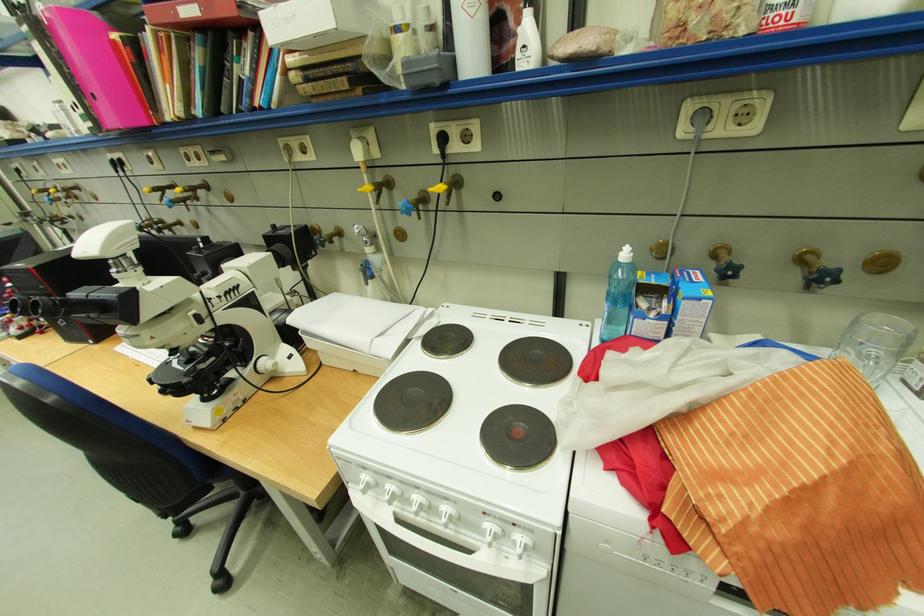
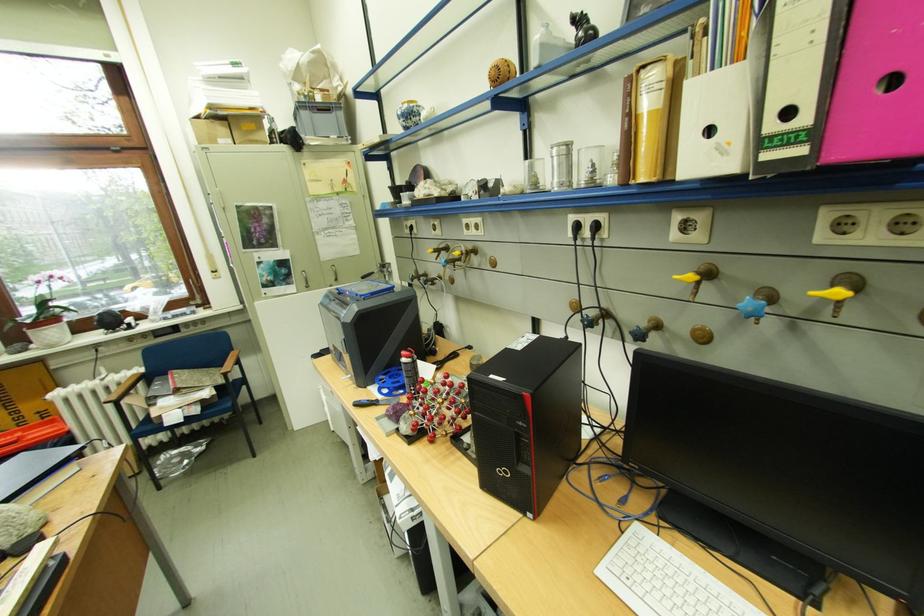
Where in the second image is the point corresponding to (157,190) from the first image?

(700, 277)